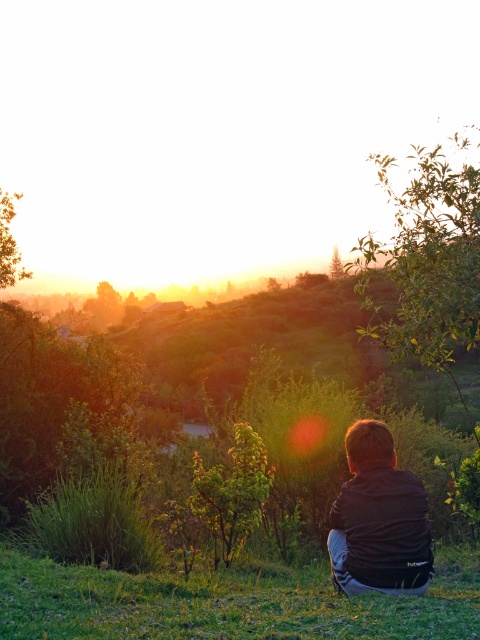
You are a photographer trying to capture the sunset. You see the green grassy at lower center and the black matte jacket at center in your camera frame. Which object is closer to the camera?

The green grassy at lower center is closer to the camera because it is not as tall as the black matte jacket at center, indicating its proximity.

You are standing at the edge of a grassy area and want to place a small garden gnome exactly where the green grassy at lower center is located. According to the coordinates provided, what are the exact coordinates where you should place the gnome?

The green grassy at lower center is located at coordinates point (228, 602), so you should place the gnome there.

You are a photographer standing at the base of the hill where the green grassy at lower center and the black matte jacket at center are located. You want to take a photo that includes both objects in the frame. Given that your camera has a maximum focus range of 30 inches, will you be able to capture both objects clearly without moving?

The distance between the green grassy at lower center and the black matte jacket at center is 29.06 inches, which is within the camera maximum focus range of 30 inches. Therefore, you can capture both objects clearly without moving.